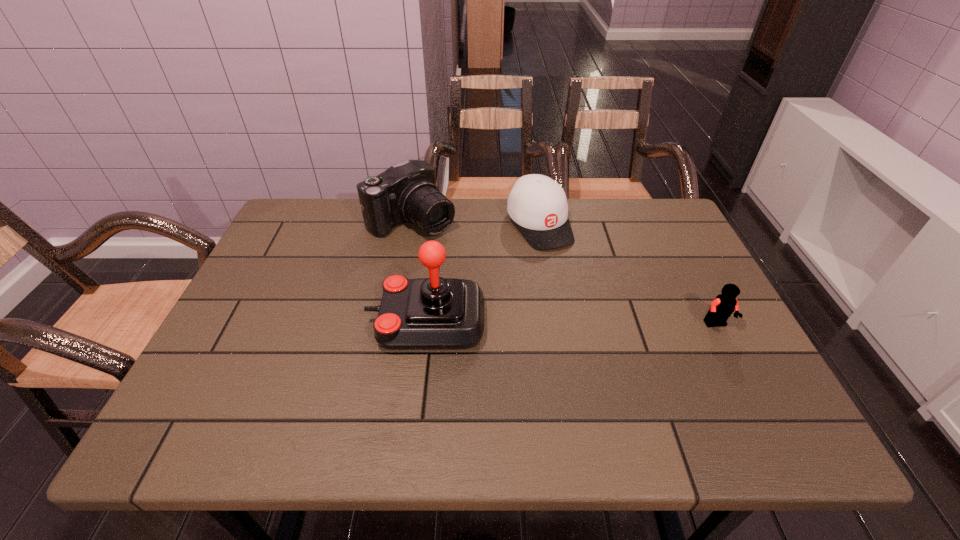
Locate an element on the screen. This screenshot has height=540, width=960. vacant region between the tallest object and the Lego is located at coordinates (571, 323).

This screenshot has height=540, width=960. In order to click on unoccupied area between the second object from right to left and the rightmost object in this screenshot , I will do `click(628, 275)`.

Where is `empty space between the tallest object and the rightmost object`? empty space between the tallest object and the rightmost object is located at coordinates (571, 323).

The image size is (960, 540). I want to click on the closest object relative to the tallest object, so click(538, 205).

At what (x,y) coordinates should I click in order to perform the action: click on object that is the second closest to the baseball cap. Please return your answer as a coordinate pair (x, y). Looking at the image, I should click on (432, 313).

This screenshot has height=540, width=960. I want to click on vacant region that satisfies the following two spatial constraints: 1. on the front side of the baseball cap; 2. on the left side of the second tallest object, so click(411, 225).